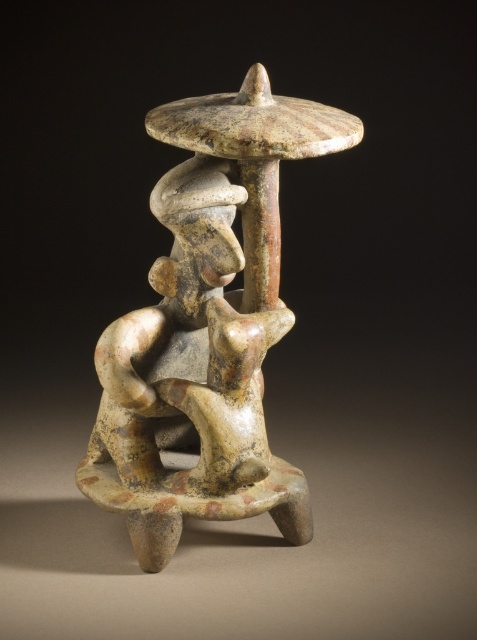
You are an art restorer examining the speckled clay figure at center and the matte ceramic figure at center. Which one would you need to handle with more care due to its position relative to the viewer?

The speckled clay figure at center is closer to the viewer than the matte ceramic figure at center, so it requires more careful handling to avoid accidental contact.

You are an art conservator standing 3 feet away from a display case containing the speckled clay figure at center. Can you reach the figure to clean it without moving the case?

The speckled clay figure at center is 30.91 inches away from viewer. Since 3 feet equals 36 inches, the distance from the conservator to the figure is within reach, so yes, the conservator can clean it without moving the case.